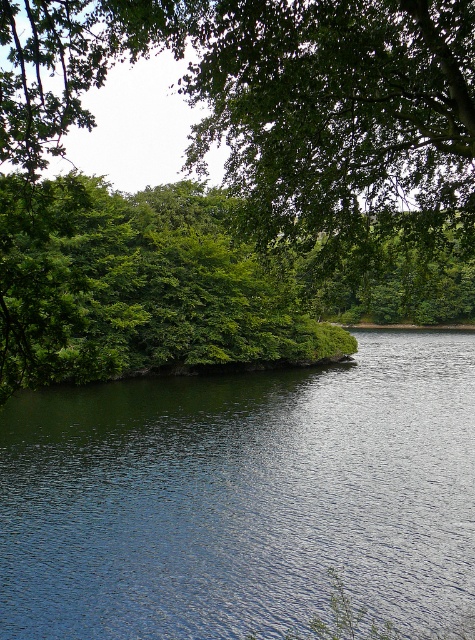
You are an environmental scientist analyzing the image. You need to determine which object occupies more visual space in the scene. Based on the description, which one is larger in size between the green leafy tree at upper center and the dark blue water at center?

The green leafy tree at upper center has a larger size compared to the dark blue water at center, so it occupies more visual space in the scene.

You are standing at the edge of the water in the scene. Which object, the green leafy tree at upper center or the dark blue water at center, is higher from your viewpoint?

The green leafy tree at upper center is taller than the dark blue water at center, so the green leafy tree at upper center is higher from your viewpoint.

You are standing at the edge of the water and see the green leafy tree at upper center and the dark blue water at center. Which object is higher in the image?

The green leafy tree at upper center is above the dark blue water at center in the image.